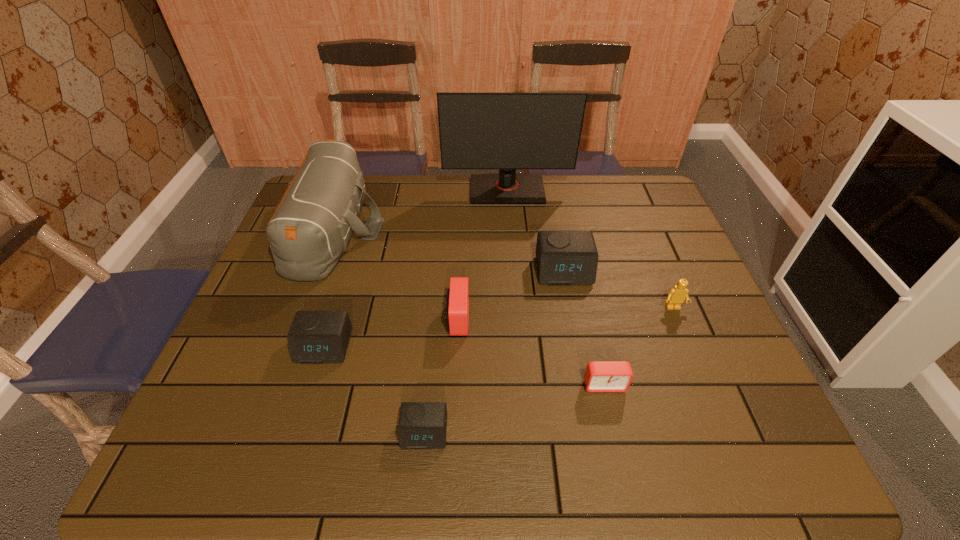
Image resolution: width=960 pixels, height=540 pixels. Identify the location of monitor. (507, 131).

The width and height of the screenshot is (960, 540). I want to click on the tallest object, so click(x=507, y=131).

Image resolution: width=960 pixels, height=540 pixels. Identify the location of duffel bag. (312, 225).

Identify the location of the rightmost black alarm clock. This screenshot has height=540, width=960. (563, 257).

Locate an element on the screen. This screenshot has height=540, width=960. the biggest black alarm clock is located at coordinates (563, 257).

You are a GUI agent. You are given a task and a screenshot of the screen. Output one action in this format:
    pyautogui.click(x=<x>, y=<y>)
    Task: Click on the Lego
    
    Given the screenshot: What is the action you would take?
    pyautogui.click(x=676, y=296)

Image resolution: width=960 pixels, height=540 pixels. Find the location of `the left red alarm clock`. the left red alarm clock is located at coordinates (457, 301).

The width and height of the screenshot is (960, 540). What are the coordinates of `the farther red alarm clock` in the screenshot? It's located at (457, 301).

Find the location of a particular element. Image resolution: width=960 pixels, height=540 pixels. the leftmost alarm clock is located at coordinates (315, 337).

Locate an element on the screen. This screenshot has width=960, height=540. the second farthest black alarm clock is located at coordinates tap(315, 337).